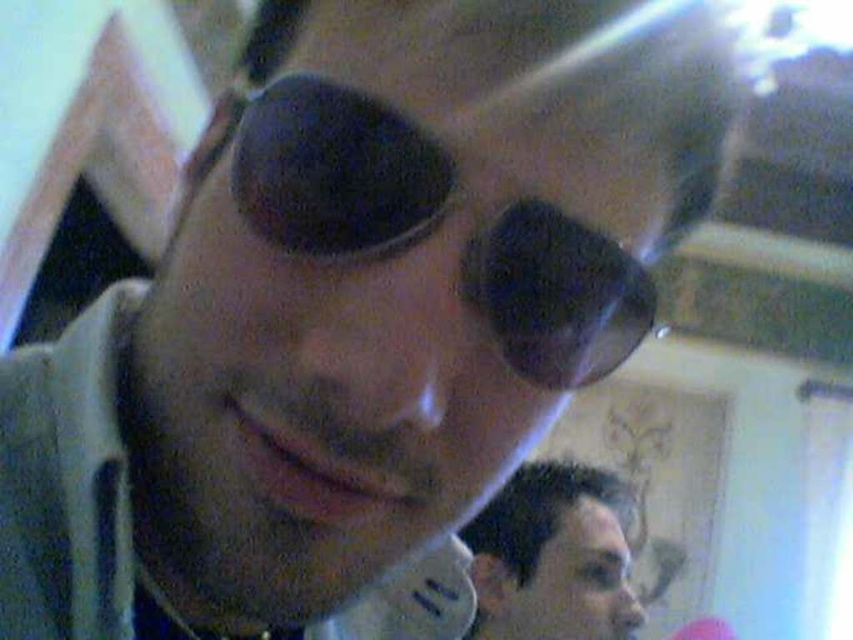
Describe the element at coordinates (334, 172) in the screenshot. This screenshot has width=853, height=640. I see `black rubber goggles at center` at that location.

Who is taller, black rubber goggles at center or dark brown hair at lower right?

With more height is dark brown hair at lower right.

Does point (555, 321) lie in front of point (614, 582)?

Yes.

Where is `black rubber goggles at center`? Image resolution: width=853 pixels, height=640 pixels. black rubber goggles at center is located at coordinates (334, 172).